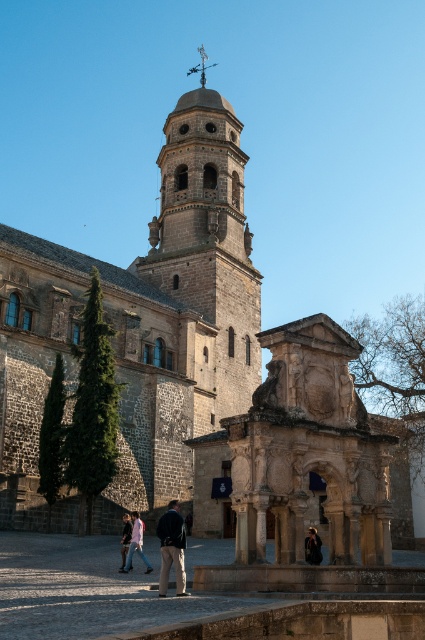
Question: Which of the following is the farthest from the observer?

Choices:
 (A) (184, 566)
 (B) (142, 556)
 (C) (192, 484)
 (D) (314, 554)

Answer: (C)

Question: Does dark blue fabric jacket at center appear under light blue denim jacket at lower left?

Choices:
 (A) yes
 (B) no

Answer: (B)

Question: Can you confirm if dark brown leather jacket at center is bigger than dark blue jeans at lower left?

Choices:
 (A) no
 (B) yes

Answer: (A)

Question: Is dark blue fabric jacket at center to the left of dark brown leather jacket at center from the viewer's perspective?

Choices:
 (A) yes
 (B) no

Answer: (A)

Question: Which object is closer to the camera taking this photo?

Choices:
 (A) dark gray stone church at center
 (B) dark brown leather jacket at center
 (C) dark blue jeans at lower left

Answer: (B)

Question: Which of these objects is positioned farthest from the dark blue fabric jacket at center?

Choices:
 (A) light blue denim jacket at lower left
 (B) dark brown leather jacket at center
 (C) dark gray stone church at center

Answer: (C)